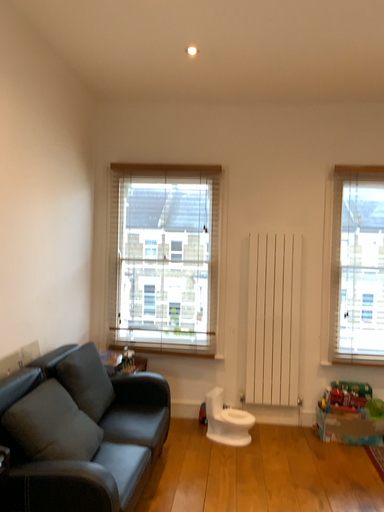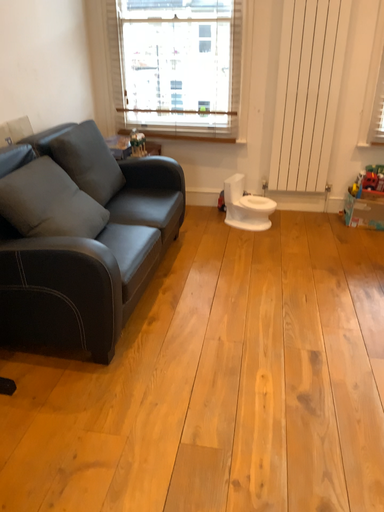
Question: Which way did the camera rotate in the video?

Choices:
 (A) rotated upward
 (B) rotated downward

Answer: (B)